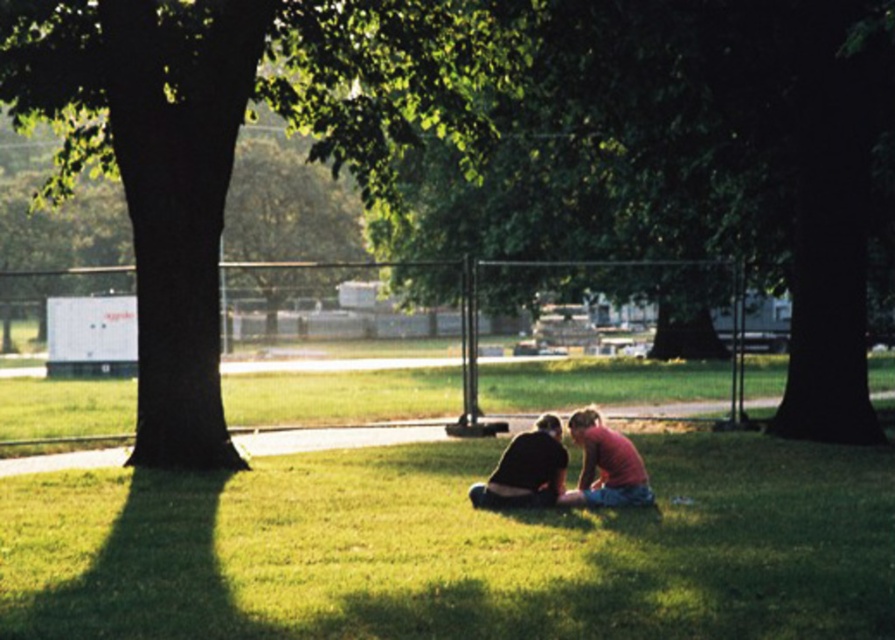
Is green grassy at center below matte pink shirt at center?

Yes, green grassy at center is below matte pink shirt at center.

Does green grassy at center lie in front of matte pink shirt at center?

Yes, it is.

Locate an element on the screen. green grassy at center is located at coordinates (455, 548).

Can you confirm if green grassy at center is wider than green leafy tree at center?

No.

Is point (256, 490) less distant than point (294, 76)?

Yes.

Is point (30, 611) positioned before point (176, 280)?

That is True.

Find the location of a particular element. green grassy at center is located at coordinates (455, 548).

Does dark brown leather jacket at center appear on the left side of matte pink shirt at center?

Yes, dark brown leather jacket at center is to the left of matte pink shirt at center.

Does dark brown leather jacket at center have a smaller size compared to matte pink shirt at center?

Yes.

Between point (521, 502) and point (587, 500), which one is positioned in front?

Point (521, 502) is in front.

Locate an element on the screen. Image resolution: width=895 pixels, height=640 pixels. dark brown leather jacket at center is located at coordinates (526, 470).